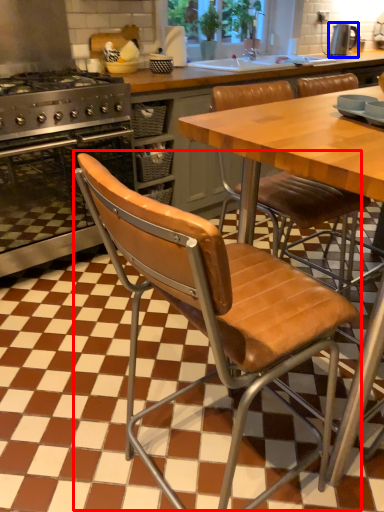
Question: Which object appears closest to the camera in this image, chair (highlighted by a red box) or kitchen appliance (highlighted by a blue box)?

Choices:
 (A) chair
 (B) kitchen appliance

Answer: (A)